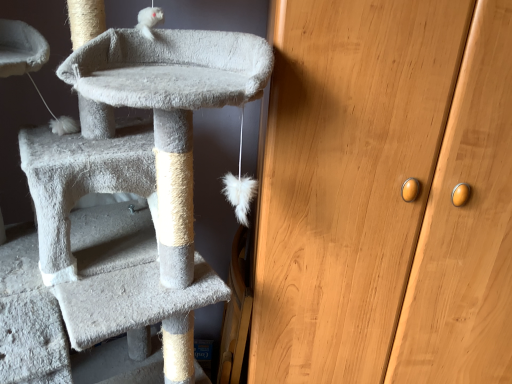
Describe the element at coordinates (386, 195) in the screenshot. I see `wooden cabinet at right` at that location.

Measure the distance between point (409, 366) and camera.

A distance of 1.04 meters exists between point (409, 366) and camera.

Locate an element on the screen. Image resolution: width=512 pixels, height=384 pixels. wooden cabinet at right is located at coordinates (386, 195).

This screenshot has height=384, width=512. What do you see at coordinates (138, 135) in the screenshot?
I see `soft gray carpeted cat tree at left` at bounding box center [138, 135].

Locate an element on the screen. This screenshot has height=384, width=512. soft gray carpeted cat tree at left is located at coordinates (138, 135).

At what (x,y) coordinates should I click in order to perform the action: click on wooden cabinet at right. Please return your answer as a coordinate pair (x, y). This screenshot has width=512, height=384. Looking at the image, I should click on (386, 195).

In the scene shown: Which is more to the left, wooden cabinet at right or soft gray carpeted cat tree at left?

Positioned to the left is soft gray carpeted cat tree at left.

Between wooden cabinet at right and soft gray carpeted cat tree at left, which one is positioned behind?

wooden cabinet at right.

Does point (481, 82) come behind point (113, 145)?

No, (481, 82) is closer to viewer.

From the image's perspective, which one is positioned lower, wooden cabinet at right or soft gray carpeted cat tree at left?

From the image's view, soft gray carpeted cat tree at left is below.

From a real-world perspective, which is physically above, wooden cabinet at right or soft gray carpeted cat tree at left?

From a 3D spatial view, soft gray carpeted cat tree at left is above.

Considering the sizes of objects wooden cabinet at right and soft gray carpeted cat tree at left in the image provided, who is thinner, wooden cabinet at right or soft gray carpeted cat tree at left?

Thinner between the two is wooden cabinet at right.

Which of these two, wooden cabinet at right or soft gray carpeted cat tree at left, stands shorter?

soft gray carpeted cat tree at left.

Between wooden cabinet at right and soft gray carpeted cat tree at left, which one has smaller size?

With smaller size is soft gray carpeted cat tree at left.

Is wooden cabinet at right inside the boundaries of soft gray carpeted cat tree at left, or outside?

wooden cabinet at right is located beyond the bounds of soft gray carpeted cat tree at left.

Are wooden cabinet at right and soft gray carpeted cat tree at left located far from each other?

wooden cabinet at right is actually quite close to soft gray carpeted cat tree at left.

Is wooden cabinet at right turned away from soft gray carpeted cat tree at left?

No.

At what (x,y) coordinates should I click in order to perform the action: click on cat furniture below the wooden cabinet at right (from the image's perspective). Please return your answer as a coordinate pair (x, y). This screenshot has width=512, height=384. Looking at the image, I should click on (138, 135).

Between soft gray carpeted cat tree at left and wooden cabinet at right, which one appears on the left side from the viewer's perspective?

soft gray carpeted cat tree at left.

Relative to wooden cabinet at right, is soft gray carpeted cat tree at left in front or behind?

In the image, soft gray carpeted cat tree at left appears in front of wooden cabinet at right.

Considering the points (24, 131) and (353, 22), which point is behind, point (24, 131) or point (353, 22)?

Positioned behind is point (24, 131).

From the picture: From the image's perspective, is soft gray carpeted cat tree at left located above or below wooden cabinet at right?

soft gray carpeted cat tree at left is situated lower than wooden cabinet at right in the image.

From a real-world perspective, which object stands above the other?

soft gray carpeted cat tree at left is physically above.

Looking at this image, does soft gray carpeted cat tree at left have a lesser width compared to wooden cabinet at right?

No, soft gray carpeted cat tree at left is not thinner than wooden cabinet at right.

Looking at this image, does soft gray carpeted cat tree at left have a greater height compared to wooden cabinet at right?

No, soft gray carpeted cat tree at left is not taller than wooden cabinet at right.

Considering the relative sizes of soft gray carpeted cat tree at left and wooden cabinet at right in the image provided, is soft gray carpeted cat tree at left bigger than wooden cabinet at right?

No, soft gray carpeted cat tree at left is not bigger than wooden cabinet at right.

Is soft gray carpeted cat tree at left completely or partially outside of wooden cabinet at right?

soft gray carpeted cat tree at left is positioned outside wooden cabinet at right.

Is soft gray carpeted cat tree at left far away from wooden cabinet at right?

No, soft gray carpeted cat tree at left is not far from wooden cabinet at right.

Consider the image. Is soft gray carpeted cat tree at left oriented towards wooden cabinet at right?

No.

How different are the orientations of soft gray carpeted cat tree at left and wooden cabinet at right in degrees?

There is a 30.5-degree angle between the facing directions of soft gray carpeted cat tree at left and wooden cabinet at right.

What are the coordinates of `cat furniture above the wooden cabinet at right (from a real-world perspective)` in the screenshot? It's located at (138, 135).

You are a GUI agent. You are given a task and a screenshot of the screen. Output one action in this format:
    pyautogui.click(x=<x>, y=<y>)
    Task: Click on the door behind the soft gray carpeted cat tree at left
    
    Given the screenshot: What is the action you would take?
    pyautogui.click(x=386, y=195)

Locate an element on the screen. door directly beneath the soft gray carpeted cat tree at left (from a real-world perspective) is located at coordinates (386, 195).